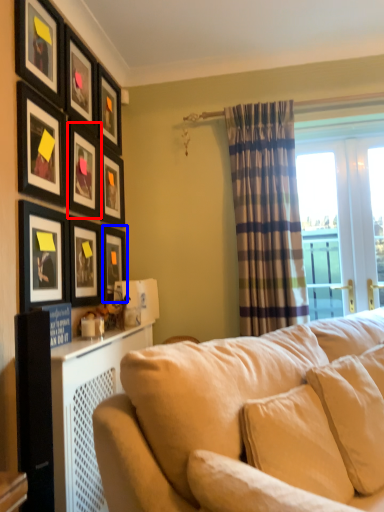
Question: Among these objects, which one is nearest to the camera, picture frame (highlighted by a red box) or picture frame (highlighted by a blue box)?

Choices:
 (A) picture frame
 (B) picture frame

Answer: (A)